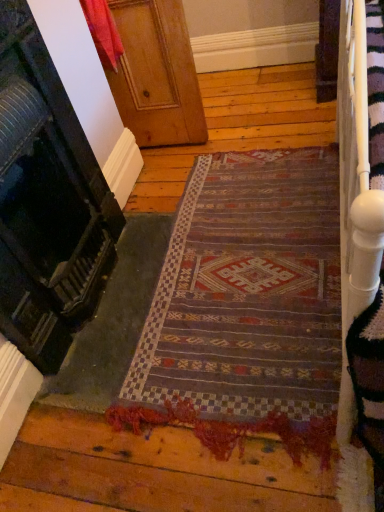
At what (x,y) coordinates should I click in order to perform the action: click on vacant area that is in front of wooden door at upper center, the second door viewed from the top. Please return your answer as a coordinate pair (x, y). The height and width of the screenshot is (512, 384). Looking at the image, I should click on (155, 414).